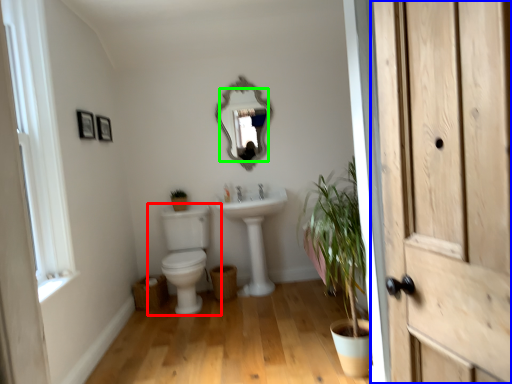
Question: Which object is positioned farthest from toilet (highlighted by a red box)? Select from door (highlighted by a blue box) and mirror (highlighted by a green box).

Choices:
 (A) door
 (B) mirror

Answer: (A)